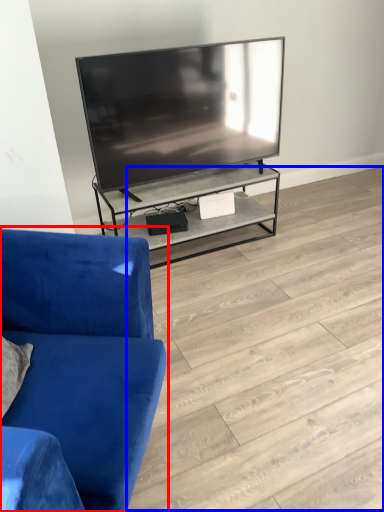
Question: Which object is closer to the camera taking this photo, studio couch (highlighted by a red box) or tile (highlighted by a blue box)?

Choices:
 (A) studio couch
 (B) tile

Answer: (A)